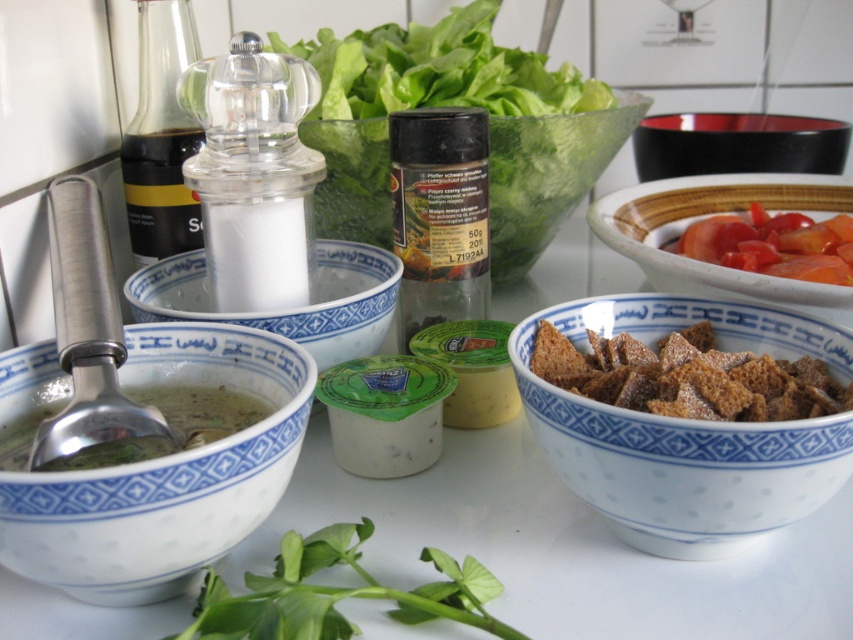
Can you confirm if brown textured bowl at center is thinner than green leafy vegetable at center?

No, brown textured bowl at center is not thinner than green leafy vegetable at center.

Between brown textured bowl at center and green leafy vegetable at center, which one appears on the left side from the viewer's perspective?

Positioned to the left is green leafy vegetable at center.

Which is in front, point (610, 422) or point (202, 602)?

Positioned in front is point (202, 602).

Locate an element on the screen. Image resolution: width=853 pixels, height=640 pixels. brown textured bowl at center is located at coordinates [x=688, y=432].

Is transparent glass spice container at center bigger than brown crumbly bread at right?

Indeed, transparent glass spice container at center has a larger size compared to brown crumbly bread at right.

The height and width of the screenshot is (640, 853). What do you see at coordinates (547, 176) in the screenshot? I see `transparent glass spice container at center` at bounding box center [547, 176].

Is point (490, 134) closer to viewer compared to point (822, 376)?

No, it is not.

Identify the location of transparent glass spice container at center. (547, 176).

In order to click on brown crumbly bread at right in this screenshot , I will do `click(688, 376)`.

Does brown crumbly bread at right come in front of green leafy vegetable at center?

No.

This screenshot has width=853, height=640. Describe the element at coordinates (688, 376) in the screenshot. I see `brown crumbly bread at right` at that location.

At what (x,y) coordinates should I click in order to perform the action: click on brown crumbly bread at right. Please return your answer as a coordinate pair (x, y). Looking at the image, I should click on (688, 376).